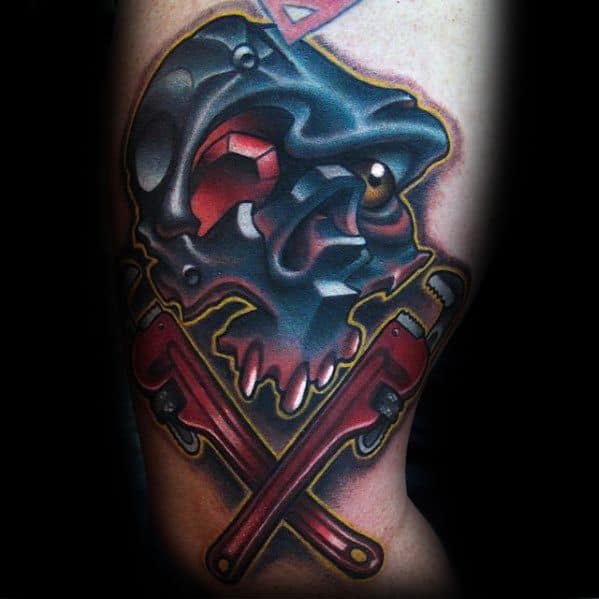
Find the location of a particular element. Image resolution: width=599 pixels, height=599 pixels. art is located at coordinates (362, 380).